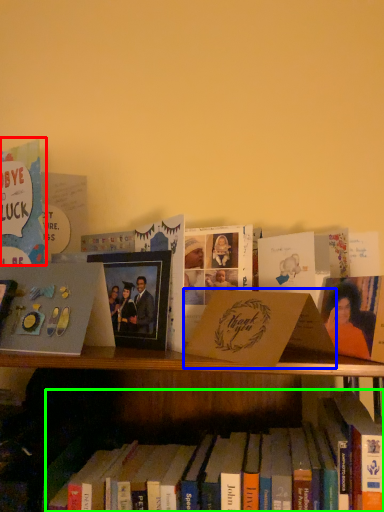
Question: Which is nearer to the book (highlighted by a red box)? paperback book (highlighted by a blue box) or book (highlighted by a green box).

Choices:
 (A) paperback book
 (B) book

Answer: (A)